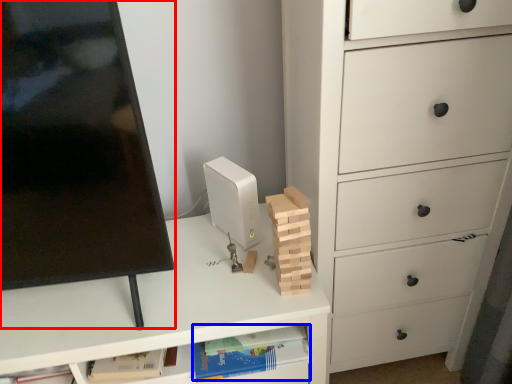
Question: Which point is closer to the camera, computer monitor (highlighted by a red box) or book (highlighted by a blue box)?

Choices:
 (A) computer monitor
 (B) book

Answer: (A)